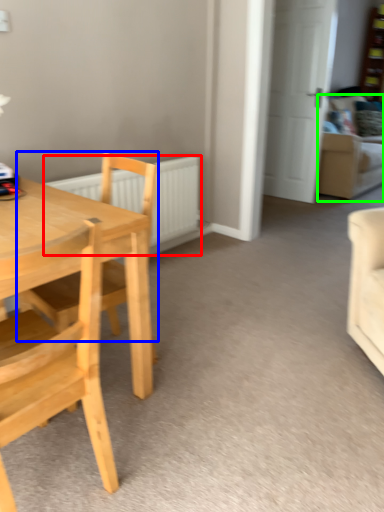
Question: Which object is the closest to the radiator (highlighted by a red box)? Choose among these: chair (highlighted by a blue box) or couch (highlighted by a green box).

Choices:
 (A) chair
 (B) couch

Answer: (A)